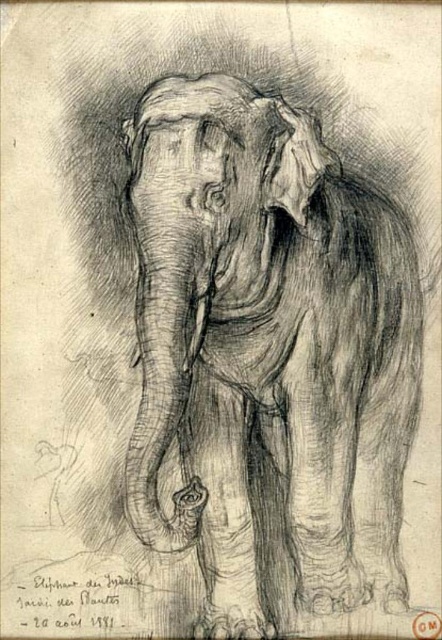
Based on the coordinates provided in the Objects Description, where is the charcoal sketch elephant at center located in the image?

The charcoal sketch elephant at center is located at point coordinates of (267,355).

You are an art student analyzing a pencil sketch of an elephant. You notice two elements labeled as the charcoal sketch elephant at center and the charcoal textured elephant head at center. Which one do you think is bigger in the image?

The charcoal sketch elephant at center is larger compared to the charcoal textured elephant head at center.